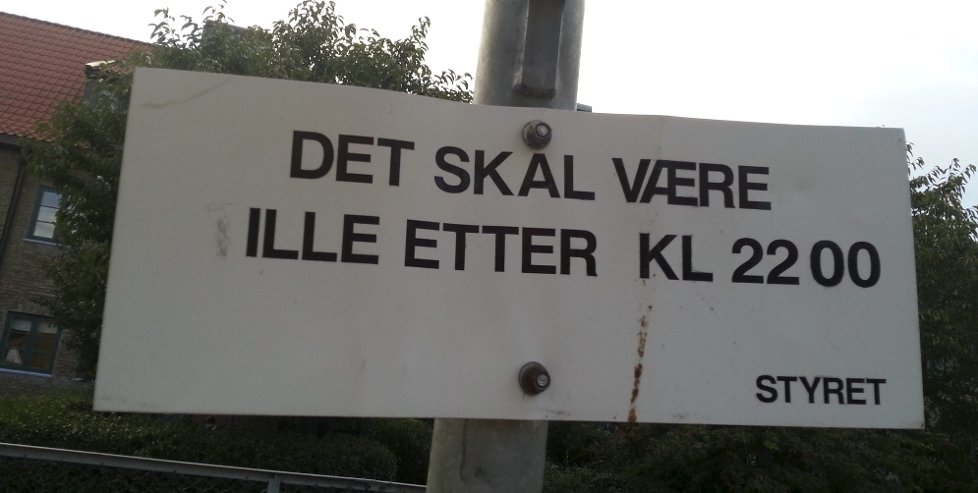
At what (x,y) coordinates should I click in order to perform the action: click on wall. Please return your answer as a coordinate pair (x, y). This screenshot has width=978, height=493. Looking at the image, I should click on (22, 271).